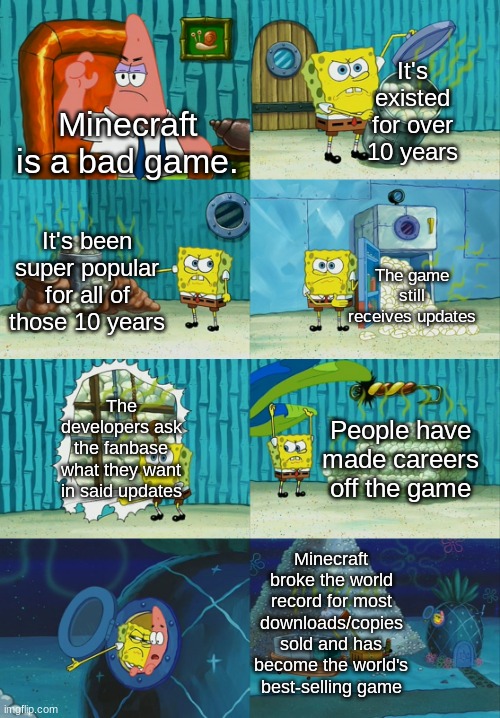
Where is `blue bamboo walls`? blue bamboo walls is located at coordinates (219, 438), (462, 382), (174, 215), (165, 23), (367, 17).